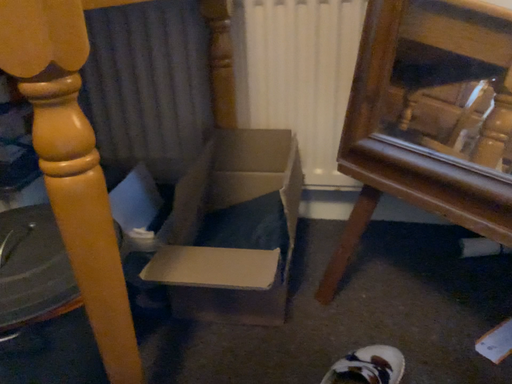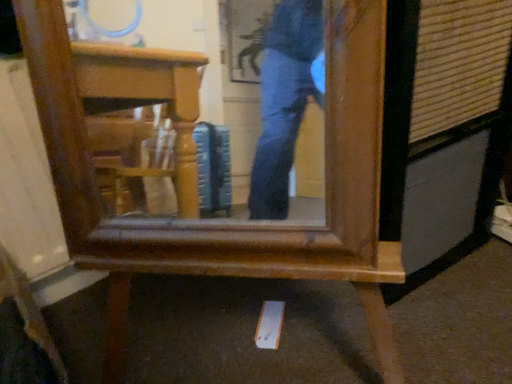
Question: How did the camera likely rotate when shooting the video?

Choices:
 (A) rotated upward
 (B) rotated downward

Answer: (A)